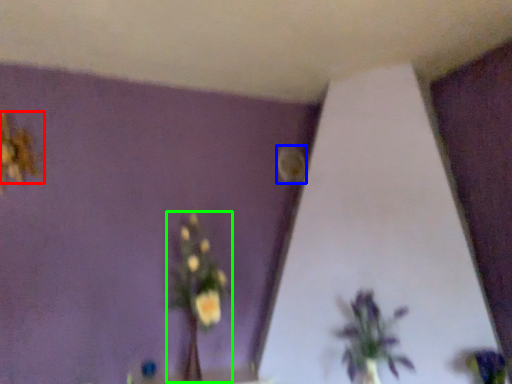
Question: Based on their relative distances, which object is farther from flower (highlighted by a red box)? Choose from flower (highlighted by a blue box) and floral arrangement (highlighted by a green box).

Choices:
 (A) flower
 (B) floral arrangement

Answer: (A)